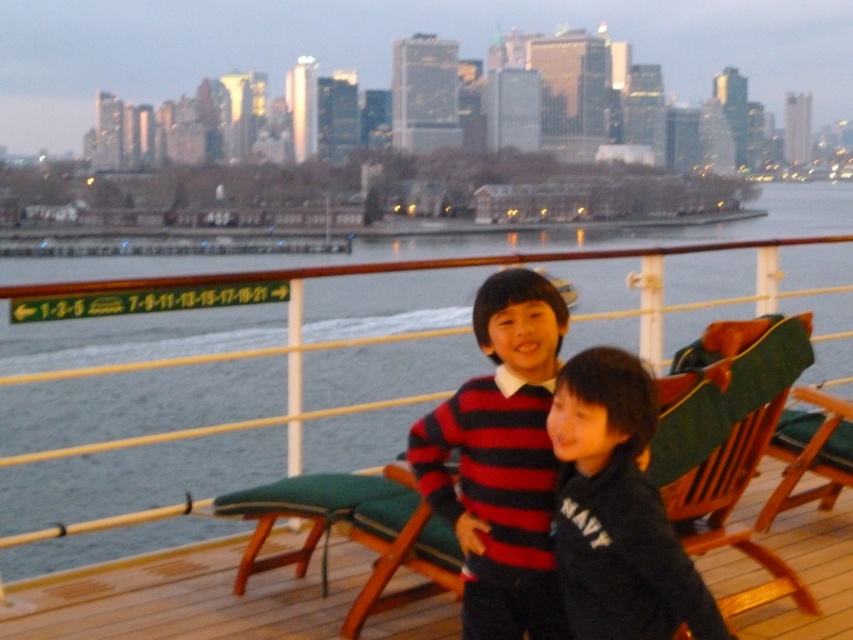
You are a photographer on the cruise ship deck. You need to capture a photo of the striped knit sweater at center and the green fabric cushion at right. However, the sweater is covering the cushion. Can you adjust the angle to show both objects clearly without moving any items?

The striped knit sweater at center is positioned over the green fabric cushion at right, so adjusting the angle might allow you to see both the sweater and the cushion beneath it without moving anything.

You are standing on the cruise ship deck and want to take a photo of the striped knit sweater at center with your camera. The camera has a maximum focus range of 4 meters. Can you capture the sweater clearly without moving closer?

The striped knit sweater at center and camera are 4.43 meters apart from each other. Since the camera can only focus up to 4 meters, you cannot capture the sweater clearly without moving closer.

You are standing on the cruise ship deck and want to take a photo of the city skyline. The camera you are using has a maximum focus range of 4 meters. Is the point at coordinates point (573, 520) within the camera focus range?

The distance between point (573, 520) and the camera is 4.17 meters, which exceeds the camera maximum focus range of 4 meters. Therefore, the camera cannot focus on that point.